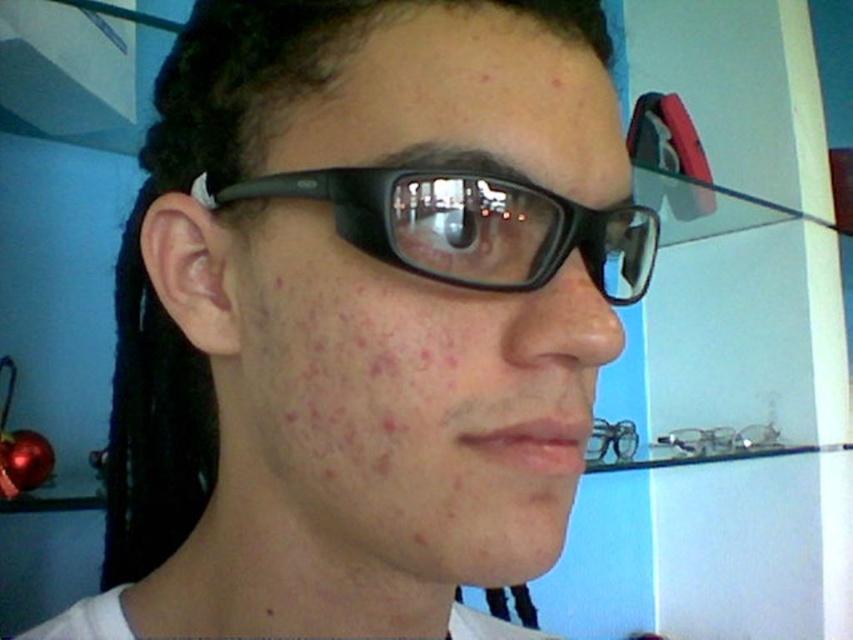
You are trying to place a 2.5 inch wide decorative item between the matte black glasses at center and the black plastic glasses at center. Will there be enough space?

The distance between the matte black glasses at center and the black plastic glasses at center is 1.56 inches, which is less than the 2.5 inch width of the decorative item. Therefore, there is not enough space to place it between them.

You are trying to decide between two pairs of glasses at the store. You notice the matte black glasses at center and the black plastic glasses at center. Which pair has a thinner frame?

The matte black glasses at center is thinner than black plastic glasses at center, so the matte black glasses at center has a thinner frame.